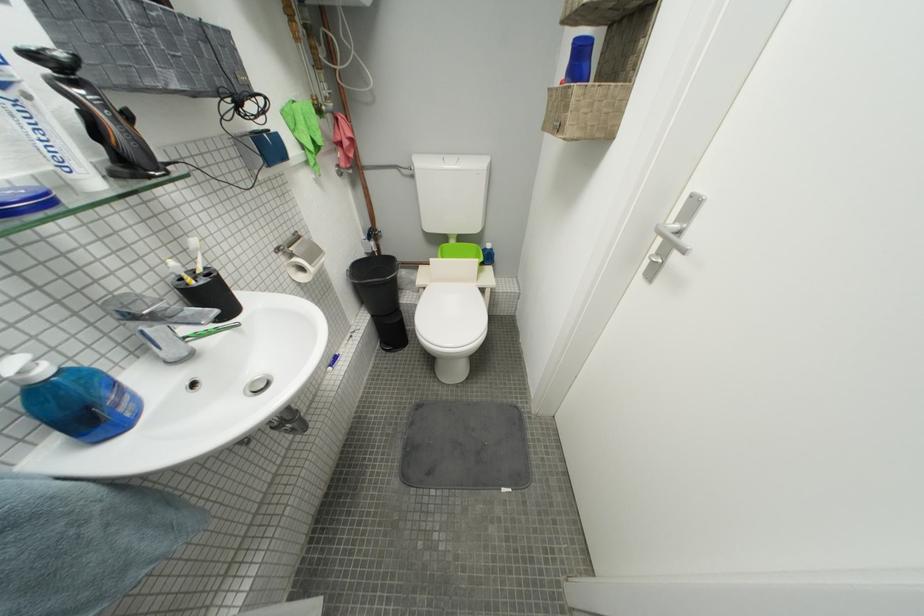
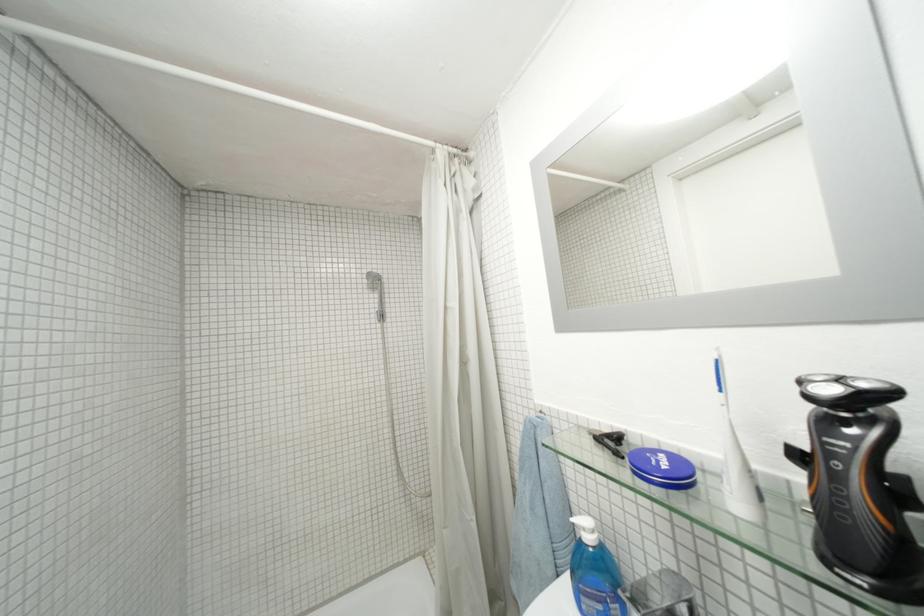
Where in the second image is the point corresponding to point 53,374 from the first image?

(598, 541)